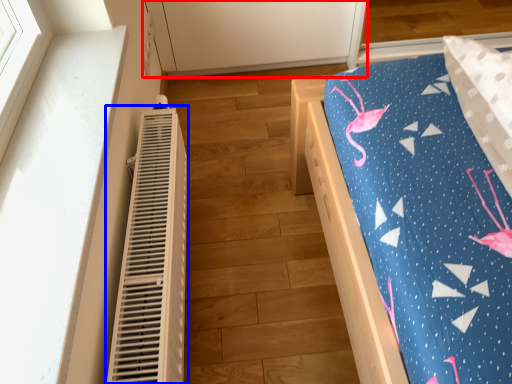
Question: Which object is closer to the camera taking this photo, cabinetry (highlighted by a red box) or heater (highlighted by a blue box)?

Choices:
 (A) cabinetry
 (B) heater

Answer: (B)